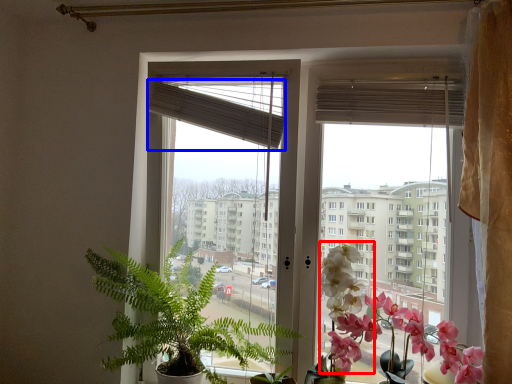
Question: Which point is closer to the camera, flower (highlighted by a red box) or blind (highlighted by a blue box)?

Choices:
 (A) flower
 (B) blind

Answer: (A)